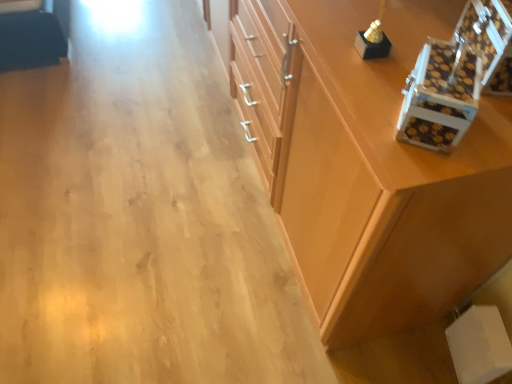
This screenshot has width=512, height=384. Identify the location of free location to the left of wooden cabinet at center. (131, 140).